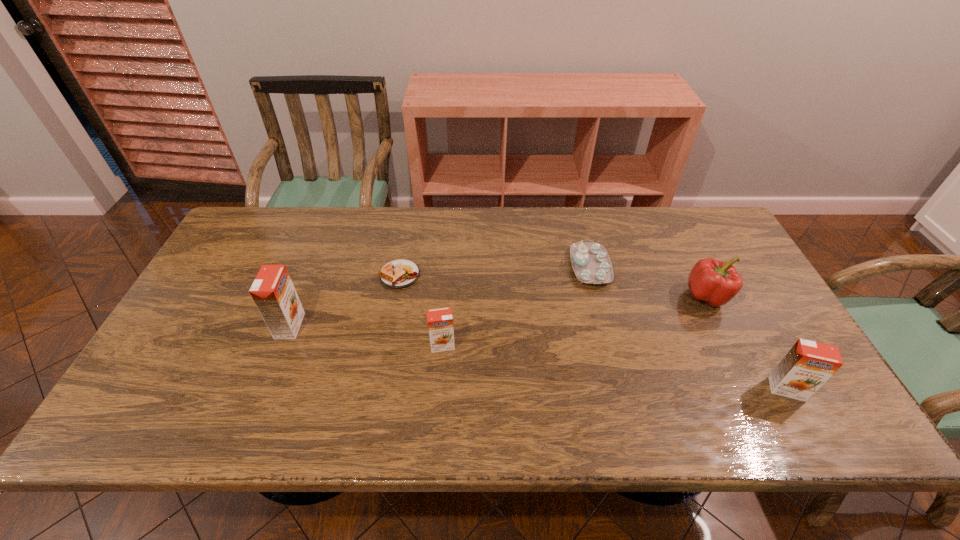
Image resolution: width=960 pixels, height=540 pixels. Find the location of `sandwich`. sandwich is located at coordinates (401, 273).

Locate an element on the screen. This screenshot has height=540, width=960. free space located on the left of the tallest object is located at coordinates (196, 326).

Identify the location of vacant region located 0.220m on the right of the second orange juice from right to left. (542, 345).

Locate an element on the screen. The width and height of the screenshot is (960, 540). free location located 0.390m on the left of the rightmost orange juice is located at coordinates (602, 389).

Locate an element on the screen. Image resolution: width=960 pixels, height=540 pixels. free space located 0.390m on the left of the chinaware is located at coordinates (441, 267).

I want to click on vacant space located 0.210m on the back of the bell pepper, so click(x=676, y=234).

Find the location of `free space located 0.150m on the right of the sandwich`. free space located 0.150m on the right of the sandwich is located at coordinates (471, 275).

The height and width of the screenshot is (540, 960). Identify the location of object at the far edge. (591, 263).

At what (x,y) coordinates should I click in order to perform the action: click on object that is at the near edge. Please return your answer as a coordinate pair (x, y). The image size is (960, 540). Looking at the image, I should click on (807, 366).

Image resolution: width=960 pixels, height=540 pixels. Find the location of `orange juice at the right edge`. orange juice at the right edge is located at coordinates (807, 366).